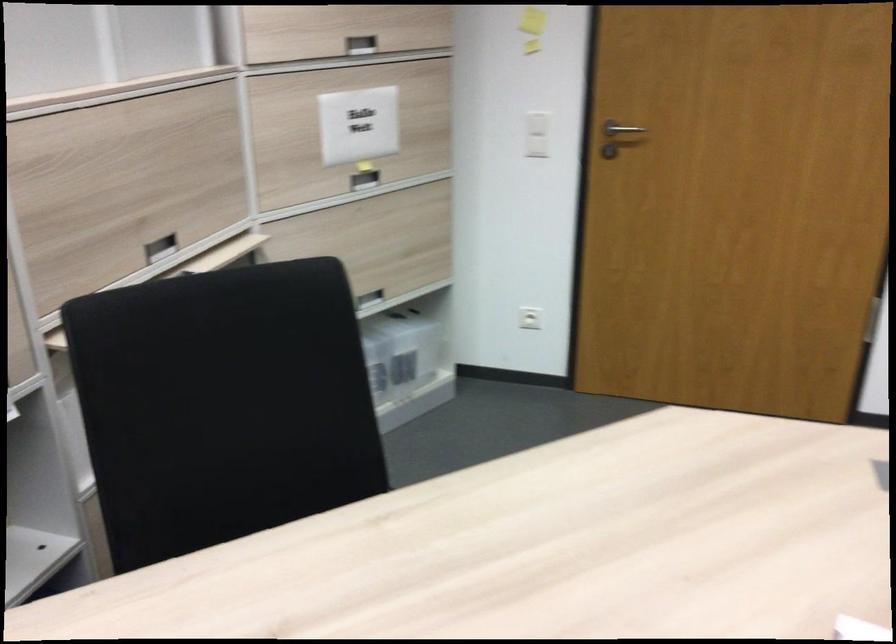
Locate an element on the screen. The width and height of the screenshot is (896, 644). white light switch is located at coordinates (358, 125).